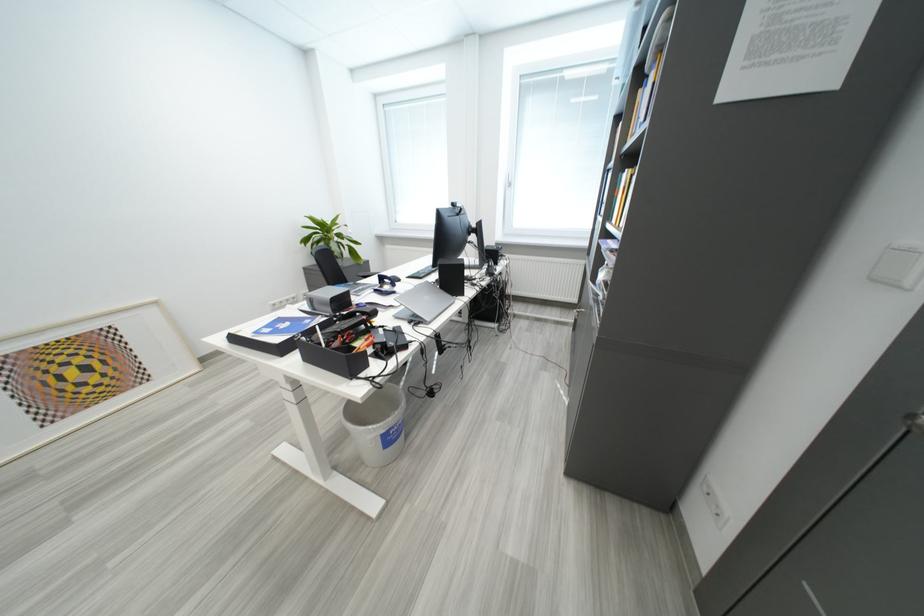
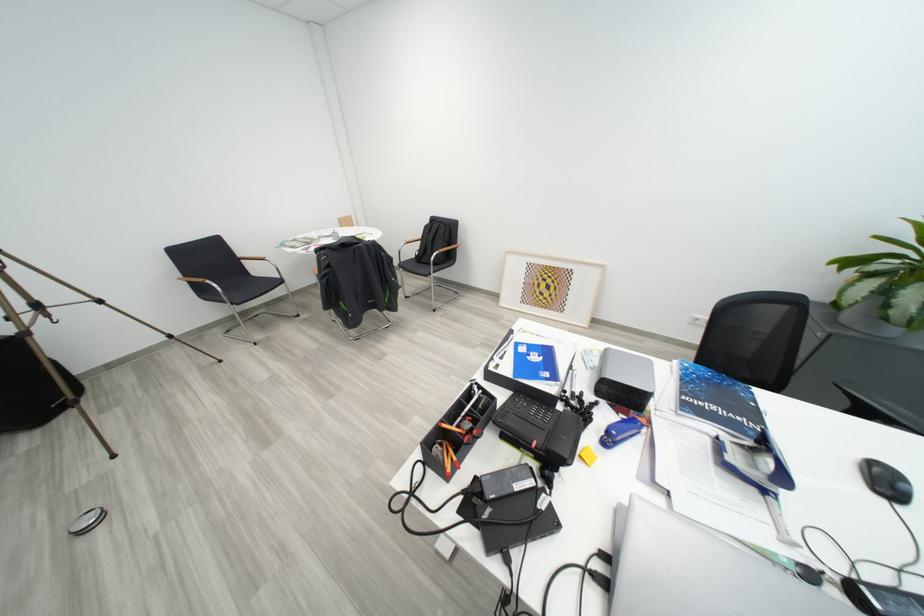
The images are taken continuously from a first-person perspective. In which direction is your viewpoint rotating?

The rotation direction of the camera is left-down.